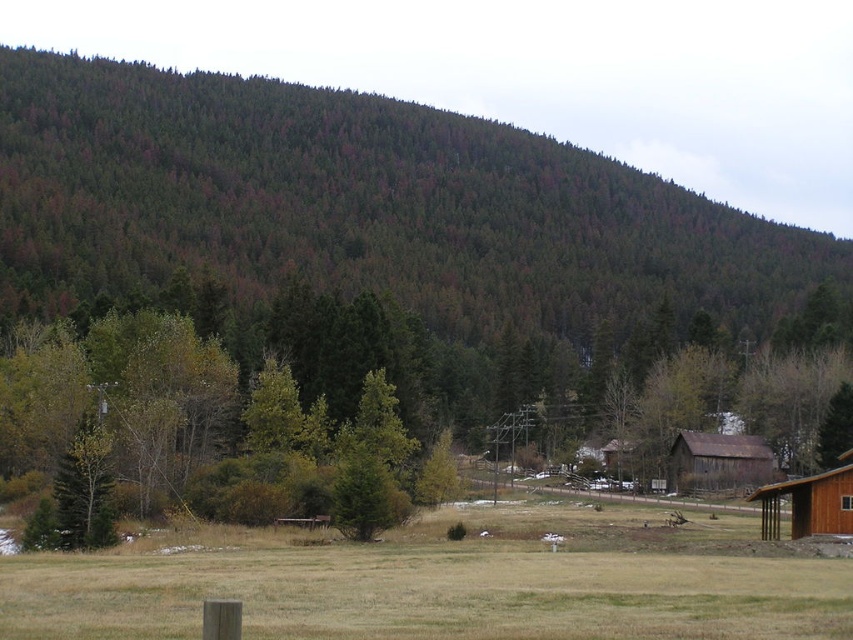
Does green forested hillside at upper center appear over brown wooden barn at lower right?

Yes.

Which is behind, point (270, 250) or point (819, 484)?

Point (270, 250)

Measure the distance between green forested hillside at upper center and camera.

green forested hillside at upper center and camera are 158.22 meters apart from each other.

At what (x,y) coordinates should I click in order to perform the action: click on green forested hillside at upper center. Please return your answer as a coordinate pair (x, y). The image size is (853, 640). Looking at the image, I should click on (360, 205).

What do you see at coordinates (718, 461) in the screenshot? I see `rustic wood barn at center-right` at bounding box center [718, 461].

Who is higher up, rustic wood barn at center-right or brown wooden barn at lower right?

brown wooden barn at lower right is higher up.

Which is in front, point (698, 435) or point (845, 497)?

Positioned in front is point (845, 497).

Locate an element on the screen. The image size is (853, 640). rustic wood barn at center-right is located at coordinates (718, 461).

Which of these two, green forested hillside at upper center or rustic wood barn at center-right, stands shorter?

rustic wood barn at center-right

Describe the element at coordinates (360, 205) in the screenshot. This screenshot has width=853, height=640. I see `green forested hillside at upper center` at that location.

Is point (12, 51) closer to viewer compared to point (756, 481)?

No, (12, 51) is further to viewer.

Where is `green forested hillside at upper center`? The height and width of the screenshot is (640, 853). green forested hillside at upper center is located at coordinates (360, 205).